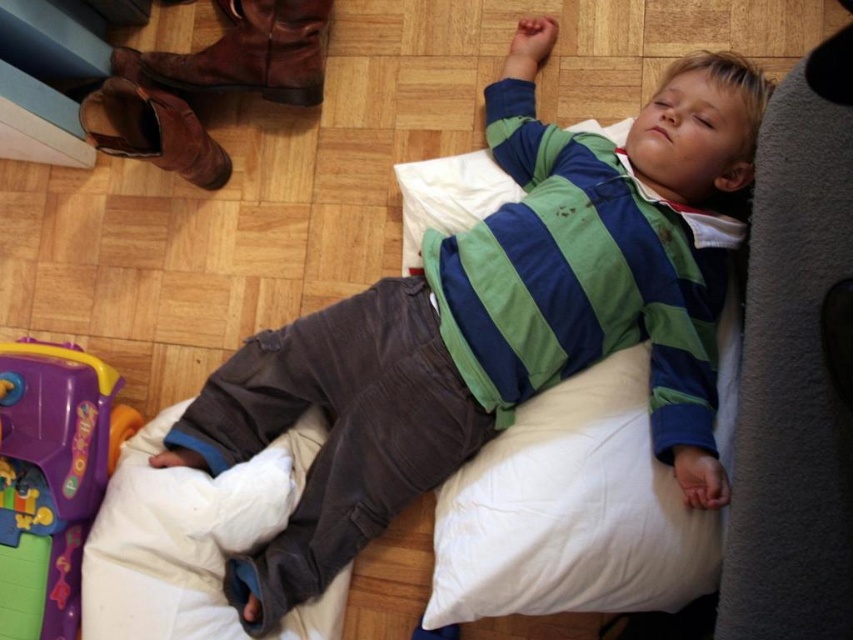
Can you confirm if green striped shirt at center is positioned above purple plastic toy at lower left?

Correct, green striped shirt at center is located above purple plastic toy at lower left.

What do you see at coordinates (497, 323) in the screenshot? This screenshot has height=640, width=853. I see `green striped shirt at center` at bounding box center [497, 323].

Who is more distant from viewer, [691,304] or [68,440]?

The point [68,440] is behind.

Image resolution: width=853 pixels, height=640 pixels. I want to click on green striped shirt at center, so coord(497,323).